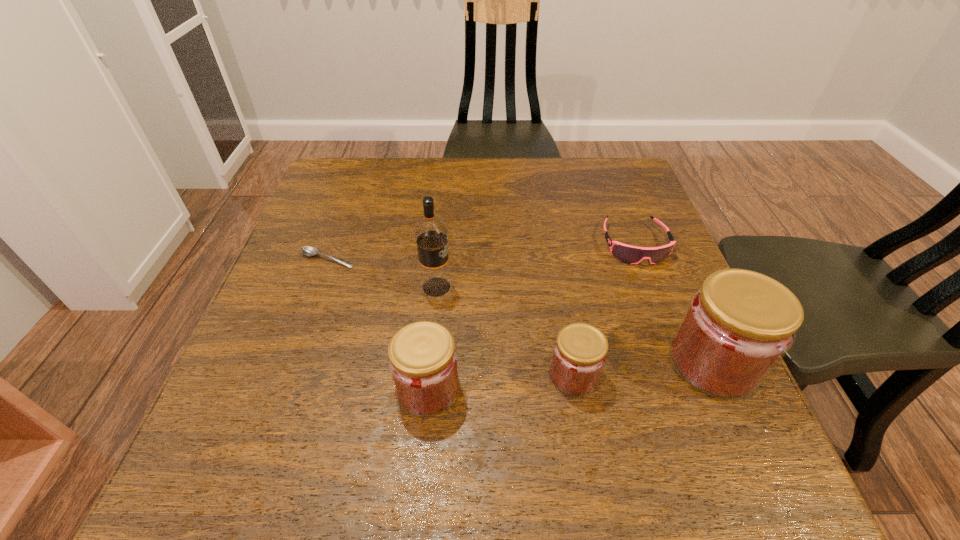
This screenshot has width=960, height=540. What are the coordinates of `the second shortest object` in the screenshot? It's located at (629, 254).

You are a GUI agent. You are given a task and a screenshot of the screen. Output one action in this format:
    pyautogui.click(x=<x>, y=<y>)
    Task: Click on the free space located 0.290m on the back of the fourth shortest object
    
    Given the screenshot: What is the action you would take?
    pyautogui.click(x=441, y=255)

In order to click on free spot located 0.260m on the left of the second jam from left to right in this screenshot , I will do `click(403, 375)`.

Locate an element on the screen. This screenshot has height=540, width=960. blank space located on the left of the rightmost jam is located at coordinates (549, 362).

Identify the location of free space located 0.330m on the right of the soupspoon. pos(500,259).

You are a GUI agent. You are given a task and a screenshot of the screen. Output one action in this format:
    pyautogui.click(x=<x>, y=<y>)
    Task: Click on the free space located 0.180m on the label of the vodka
    The image size is (960, 540).
    Given the screenshot: What is the action you would take?
    pyautogui.click(x=537, y=287)

Locate an element on the screen. vacant area situated on the front-facing side of the goggles is located at coordinates (686, 380).

Locate an element on the screen. The width and height of the screenshot is (960, 540). object present at the left edge is located at coordinates (307, 250).

Locate an element on the screen. jam that is at the right edge is located at coordinates (739, 324).

Image resolution: width=960 pixels, height=540 pixels. I want to click on goggles that is positioned at the right edge, so click(x=629, y=254).